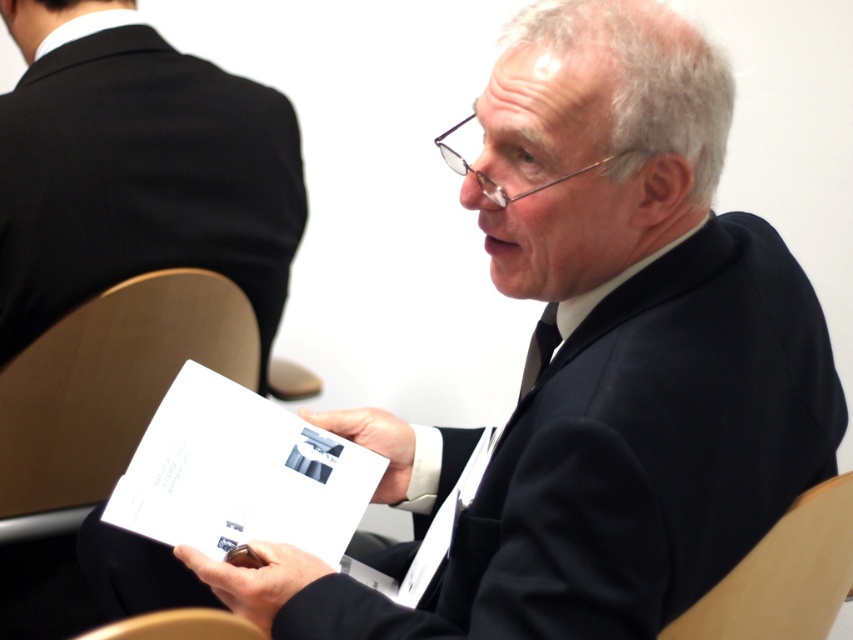
Does point (254, 314) come behind point (177, 632)?

Yes, point (254, 314) is farther from viewer.

Which is below, black suit at upper left or wooden at lower left?

wooden at lower left is lower down.

Locate an element on the screen. Image resolution: width=853 pixels, height=640 pixels. black suit at upper left is located at coordinates (141, 179).

Is white paper at center wider than light wood chair at right?

Yes, white paper at center is wider than light wood chair at right.

In the scene shown: Who is positioned more to the right, white paper at center or light wood chair at right?

From the viewer's perspective, light wood chair at right appears more on the right side.

Does point (268, 435) come closer to viewer compared to point (689, 624)?

No, it is behind (689, 624).

The width and height of the screenshot is (853, 640). I want to click on white paper at center, so click(x=242, y=476).

Which is more to the left, light wood chair at right or wooden at lower left?

wooden at lower left

Is light wood chair at right behind wooden at lower left?

Yes.

Is point (769, 580) behind point (178, 616)?

That is True.

This screenshot has width=853, height=640. Find the location of `light wood chair at right`. light wood chair at right is located at coordinates (782, 576).